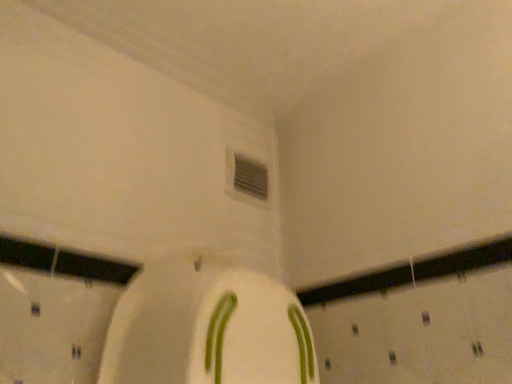
Identify the location of white matte paper towel at center. The image size is (512, 384). (207, 328).

Describe the element at coordinates (207, 328) in the screenshot. I see `white matte paper towel at center` at that location.

You are a GUI agent. You are given a task and a screenshot of the screen. Output one action in this format:
    pyautogui.click(x=<x>, y=<y>)
    Task: Click on the white matte paper towel at center
    This screenshot has width=512, height=384.
    Given the screenshot: What is the action you would take?
    pyautogui.click(x=207, y=328)